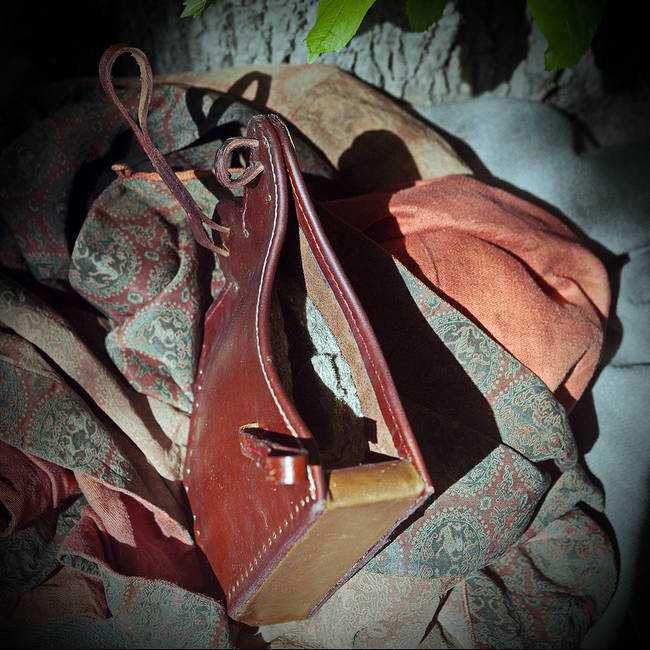
The height and width of the screenshot is (650, 650). In order to click on puffy blanket underneath purse in this screenshot , I will do `click(489, 526)`.